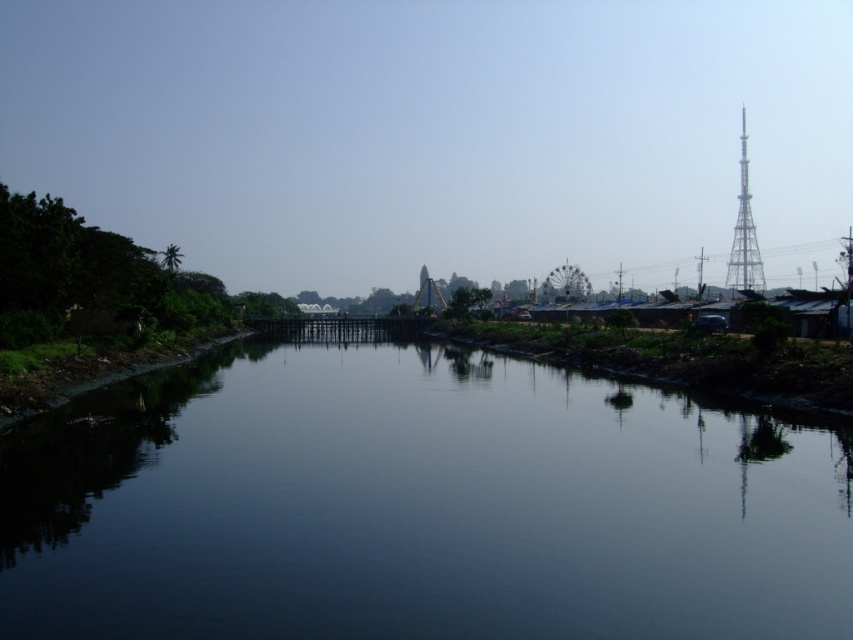
Question: Is dark water at center smaller than metallic tower at right?

Choices:
 (A) yes
 (B) no

Answer: (A)

Question: Among these points, which one is farthest from the camera?

Choices:
 (A) (515, 417)
 (B) (761, 273)

Answer: (B)

Question: Which point is farther to the camera?

Choices:
 (A) dark water at center
 (B) metallic tower at right

Answer: (B)

Question: From the image, what is the correct spatial relationship of dark water at center in relation to metallic tower at right?

Choices:
 (A) right
 (B) left

Answer: (B)

Question: Is dark water at center to the left of metallic tower at right from the viewer's perspective?

Choices:
 (A) no
 (B) yes

Answer: (B)

Question: Which object appears closest to the camera in this image?

Choices:
 (A) metallic tower at right
 (B) dark water at center

Answer: (B)